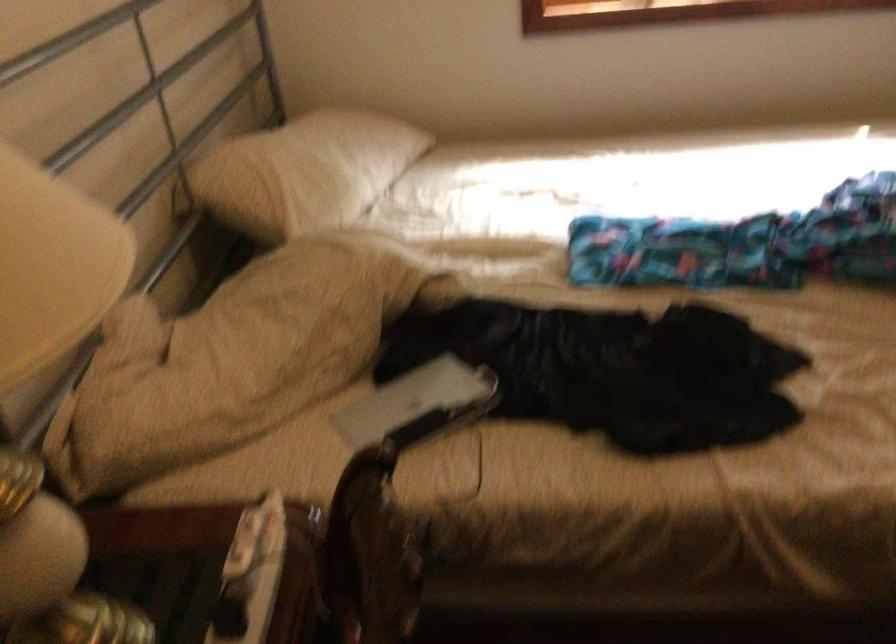
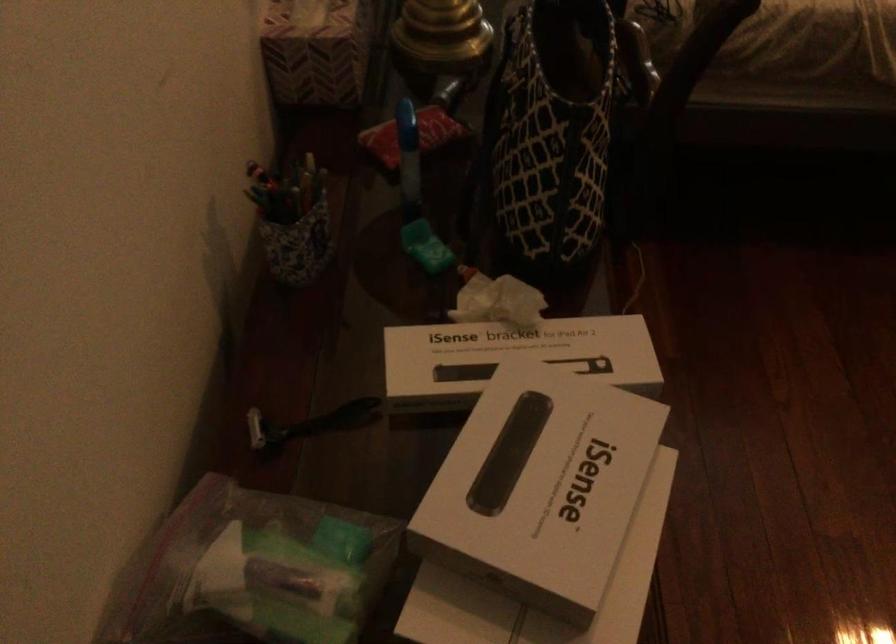
From the picture: In a continuous first-person perspective shot, in which direction is the camera moving?

The cameraman moved toward left, backward.